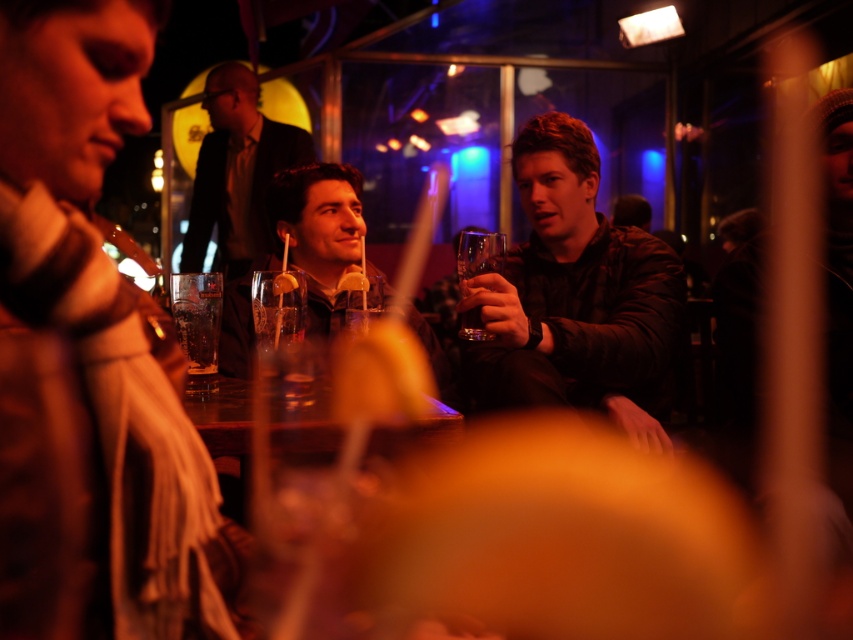
Who is positioned more to the right, leather jacket at right or clear glass at center?

leather jacket at right

Does leather jacket at right appear on the left side of clear glass at center?

Incorrect, leather jacket at right is not on the left side of clear glass at center.

What do you see at coordinates (575, 296) in the screenshot? The width and height of the screenshot is (853, 640). I see `leather jacket at right` at bounding box center [575, 296].

The image size is (853, 640). I want to click on leather jacket at right, so click(575, 296).

Which is below, dark brown leather jacket at upper center or transparent glass at right?

transparent glass at right is lower down.

Can you confirm if dark brown leather jacket at upper center is bigger than transparent glass at right?

Yes.

What do you see at coordinates (236, 172) in the screenshot? I see `dark brown leather jacket at upper center` at bounding box center [236, 172].

Find the location of a particular element. dark brown leather jacket at upper center is located at coordinates (236, 172).

Is clear glass with etched design at center to the right of transparent glass at right from the viewer's perspective?

Incorrect, clear glass with etched design at center is not on the right side of transparent glass at right.

Does clear glass with etched design at center have a larger size compared to transparent glass at right?

Correct, clear glass with etched design at center is larger in size than transparent glass at right.

I want to click on clear glass with etched design at center, so click(282, 330).